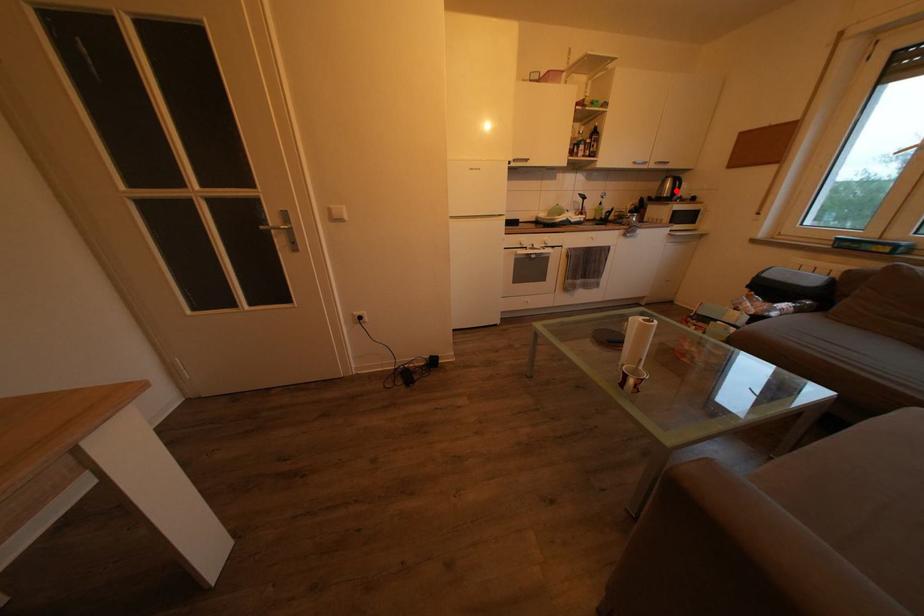
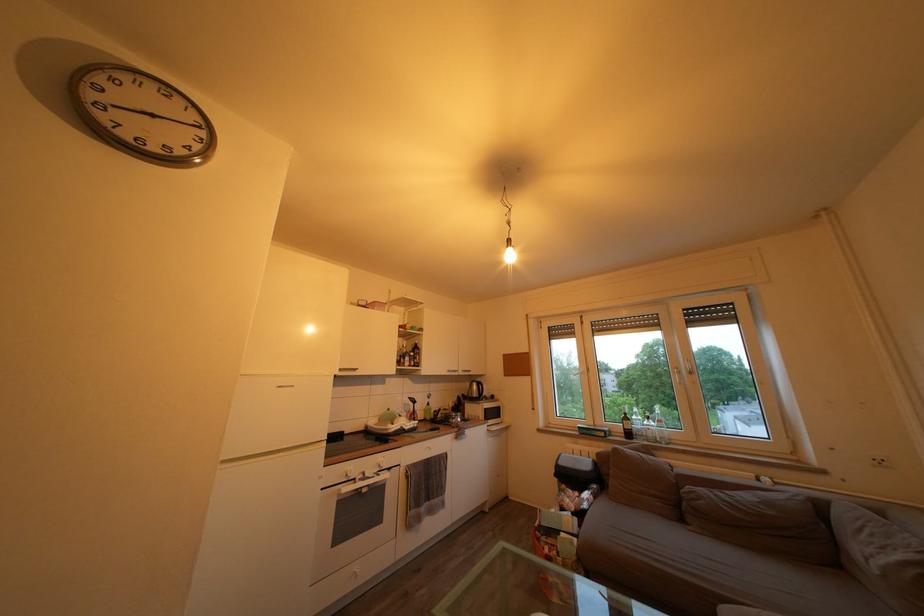
Question: A red point is marked in image1. In image2, is the corresponding 3D point closer to the camera or farther? Reply with the corresponding letter.

Choices:
 (A) The corresponding 3D point is closer.
 (B) The corresponding 3D point is farther.

Answer: (B)